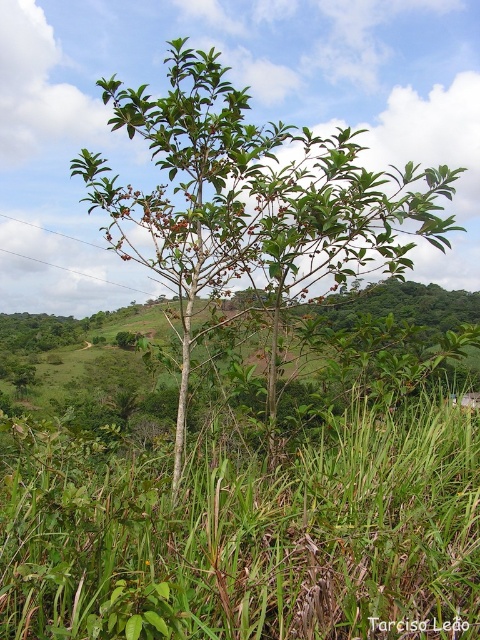
You are standing in the center of the landscape and see a point marked at coordinates (248, 536). What is located at that point?

The point at coordinates (248, 536) indicates green grass at center.

You are a gardener who needs to mow the lawn. You see the green grass at center and the green leafy tree at center in the image. Which object is shorter and requires mowing?

The green grass at center is shorter than the green leafy tree at center, so the green grass at center requires mowing.

You are standing at the center of the image and want to place a small garden statue exactly at the coordinates given for the green grass at center. What are the coordinates where you should place the statue?

The coordinates for the green grass at center are at point (x=248, y=536), so you should place the statue there.